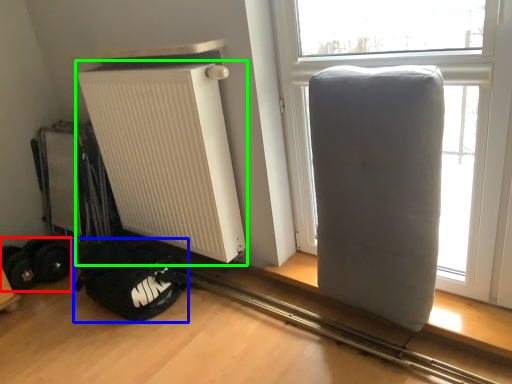
Question: Estimate the real-world distances between objects in this image. Which object is closer to wheel (highlighted by a red box), sleeping bag (highlighted by a blue box) or radiator (highlighted by a green box)?

Choices:
 (A) sleeping bag
 (B) radiator

Answer: (A)